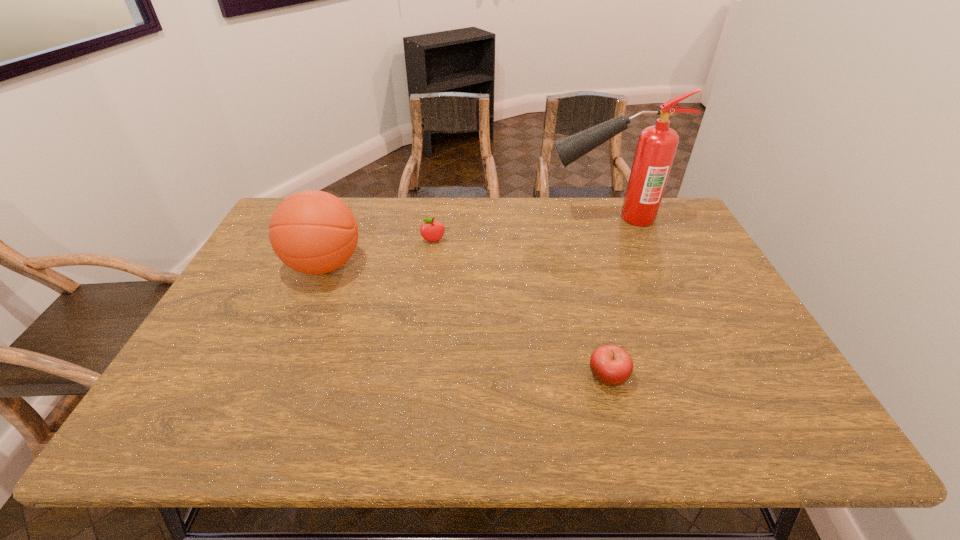
What are the coordinates of `free space between the tallest object and the second object from left to right` in the screenshot? It's located at (519, 230).

Locate an element on the screen. This screenshot has height=540, width=960. vacant region between the right apple and the farthest object is located at coordinates (607, 297).

At what (x,y) coordinates should I click in order to perform the action: click on free spot between the tallest object and the leftmost object. Please return your answer as a coordinate pair (x, y). Looking at the image, I should click on (466, 241).

Locate an element on the screen. object identified as the closest to the farther apple is located at coordinates (314, 232).

The width and height of the screenshot is (960, 540). Identify the location of the closest object to the leftmost object. (431, 231).

Locate an element on the screen. The width and height of the screenshot is (960, 540). free region that satisfies the following two spatial constraints: 1. at the nozzle of the fire extinguisher; 2. on the front side of the third shortest object is located at coordinates (624, 265).

Identify the location of free spot that satisfies the following two spatial constraints: 1. on the front side of the nearest object; 2. on the left side of the third object from right to left. pyautogui.click(x=416, y=376).

Identify the location of free space that satisfies the following two spatial constraints: 1. on the front side of the nearest object; 2. on the right side of the leftmost object. (278, 376).

Identify the location of vacant space that satisfies the following two spatial constraints: 1. on the front side of the farther apple; 2. on the right side of the nearer apple. The width and height of the screenshot is (960, 540). [416, 376].